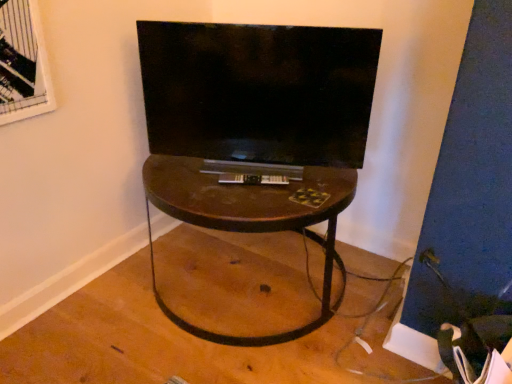
Question: From the image's perspective, relative to brown wood table at center, is matte black tv at center above or below?

Choices:
 (A) above
 (B) below

Answer: (A)

Question: Considering the positions of matte black tv at center and brown wood table at center in the image, is matte black tv at center bigger or smaller than brown wood table at center?

Choices:
 (A) small
 (B) big

Answer: (A)

Question: Estimate the real-world distances between objects in this image. Which object is farther from the brown wood table at center?

Choices:
 (A) velvet black swivel chair at lower right
 (B) matte black tv at center

Answer: (A)

Question: Based on their relative distances, which object is farther from the matte black tv at center?

Choices:
 (A) velvet black swivel chair at lower right
 (B) brown wood table at center

Answer: (A)